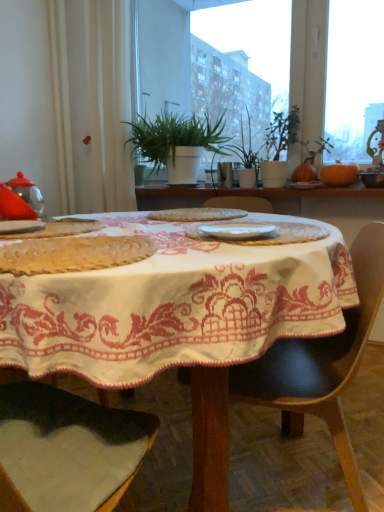
Question: From the image's perspective, relative to matte white plate at center, acting as the fourth tableware starting from the bottom, is white glossy plate at center, the third tableware viewed from the right, above or below?

Choices:
 (A) above
 (B) below

Answer: (B)

Question: Relative to matte white plate at center, the 2th tableware viewed from the right, is white glossy plate at center, which is counted as the 3th tableware, starting from the left, in front or behind?

Choices:
 (A) behind
 (B) front

Answer: (B)

Question: Which object is the closest to the matte white plate at center, acting as the fourth tableware starting from the bottom?

Choices:
 (A) black leather chair at center
 (B) green leafy plant at center, positioned as the second houseplant in right-to-left order
 (C) white matte plate at left, positioned as the 2th tableware in front-to-back order
 (D) matte ceramic bowl at upper right, positioned as the 5th tableware in bottom-to-top order
 (E) green matte plant at center, the first houseplant from the right

Answer: (D)

Question: Estimate the real-world distances between objects in this image. Which object is closer to the white glossy plate at center, which is the 5th tableware in top-to-bottom order?

Choices:
 (A) green matte plant at center, the first houseplant from the right
 (B) green leafy plant at center, positioned as the second houseplant in right-to-left order
 (C) transparent glass teapot at left, the first tableware from the left
 (D) white matte plate at left, the second tableware positioned from the left
 (E) black leather chair at center

Answer: (E)